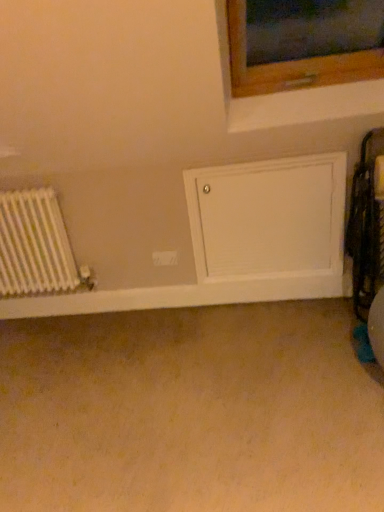
Question: Should I look upward or downward to see white metallic radiator at left?

Choices:
 (A) up
 (B) down

Answer: (A)

Question: Does white metallic radiator at left have a greater height compared to white plastic electric outlet at center?

Choices:
 (A) yes
 (B) no

Answer: (A)

Question: From the image's perspective, does white metallic radiator at left appear higher than white plastic electric outlet at center?

Choices:
 (A) no
 (B) yes

Answer: (B)

Question: Is white plastic electric outlet at center surrounded by white metallic radiator at left?

Choices:
 (A) yes
 (B) no

Answer: (B)

Question: Can you confirm if white metallic radiator at left is bigger than white plastic electric outlet at center?

Choices:
 (A) yes
 (B) no

Answer: (A)

Question: Is white plastic electric outlet at center at the back of white metallic radiator at left?

Choices:
 (A) yes
 (B) no

Answer: (B)

Question: Is white metallic radiator at left outside of white plastic electric outlet at center?

Choices:
 (A) no
 (B) yes

Answer: (B)

Question: Is white matte door at center thinner than white metallic radiator at left?

Choices:
 (A) yes
 (B) no

Answer: (A)

Question: Does white matte door at center appear on the left side of white metallic radiator at left?

Choices:
 (A) no
 (B) yes

Answer: (A)

Question: Does white matte door at center come in front of white metallic radiator at left?

Choices:
 (A) no
 (B) yes

Answer: (B)

Question: Is white matte door at center bigger than white metallic radiator at left?

Choices:
 (A) no
 (B) yes

Answer: (A)

Question: Considering the relative sizes of white matte door at center and white metallic radiator at left in the image provided, is white matte door at center smaller than white metallic radiator at left?

Choices:
 (A) yes
 (B) no

Answer: (A)

Question: Can you see white matte door at center touching white metallic radiator at left?

Choices:
 (A) no
 (B) yes

Answer: (A)

Question: Considering the relative sizes of white metallic radiator at left and white matte door at center in the image provided, is white metallic radiator at left taller than white matte door at center?

Choices:
 (A) yes
 (B) no

Answer: (B)